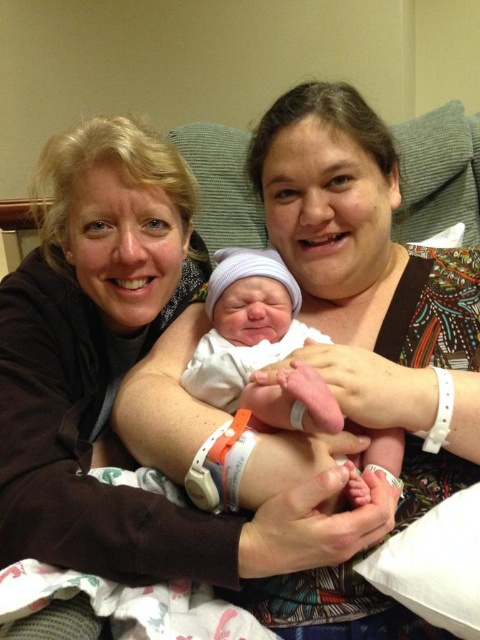
Question: Which of the following is the farthest from the observer?

Choices:
 (A) (276, 200)
 (B) (226, 320)

Answer: (A)

Question: Considering the relative positions of matte brown shirt at center and smooth white swaddle at center in the image provided, where is matte brown shirt at center located with respect to smooth white swaddle at center?

Choices:
 (A) left
 (B) right

Answer: (B)

Question: Which point appears closest to the camera in this image?

Choices:
 (A) (263, 314)
 (B) (433, 260)

Answer: (A)

Question: Can you confirm if matte brown shirt at center is bigger than smooth white swaddle at center?

Choices:
 (A) yes
 (B) no

Answer: (A)

Question: Can you confirm if matte brown shirt at center is wider than smooth white swaddle at center?

Choices:
 (A) yes
 (B) no

Answer: (A)